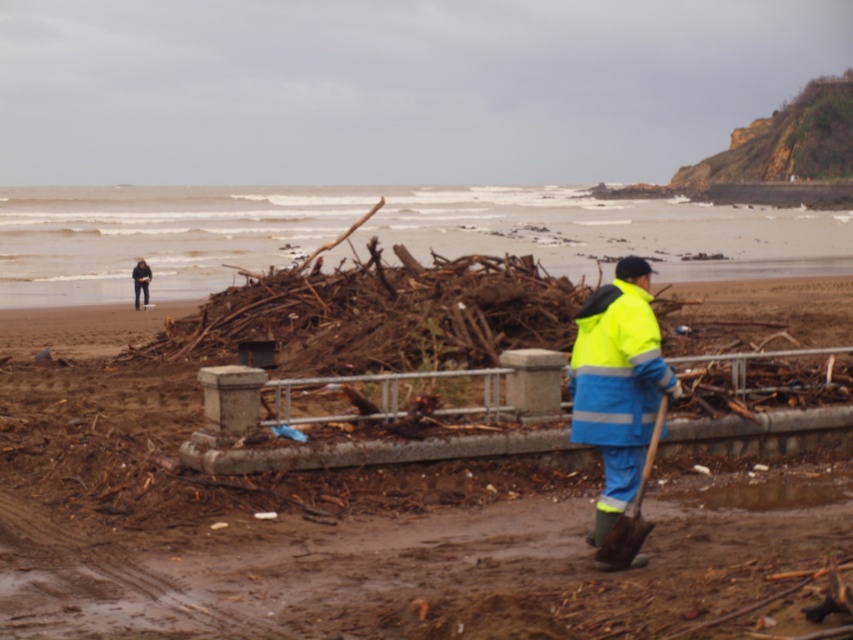
You are a beach cleanup volunteer and need to locate the wooden shovel at lower right. According to the coordinates provided, where exactly should you look on the image to find it?

The wooden shovel at lower right is located at the 2D coordinates point (631, 509) on the image.

You are a beach cleanup volunteer holding a neon yellow fabric shovel at center and a wooden shovel at lower right. You need to choose the wider shovel to dig through the debris. Which shovel should you pick?

The neon yellow fabric shovel at center might be wider than wooden shovel at lower right, so you should pick the neon yellow fabric shovel at center.

You are a beach cleanup volunteer and need to locate your neon yellow fabric shovel at center. According to the coordinates provided, where exactly should you look for it?

The neon yellow fabric shovel at center is located at coordinates point (x=618, y=387).